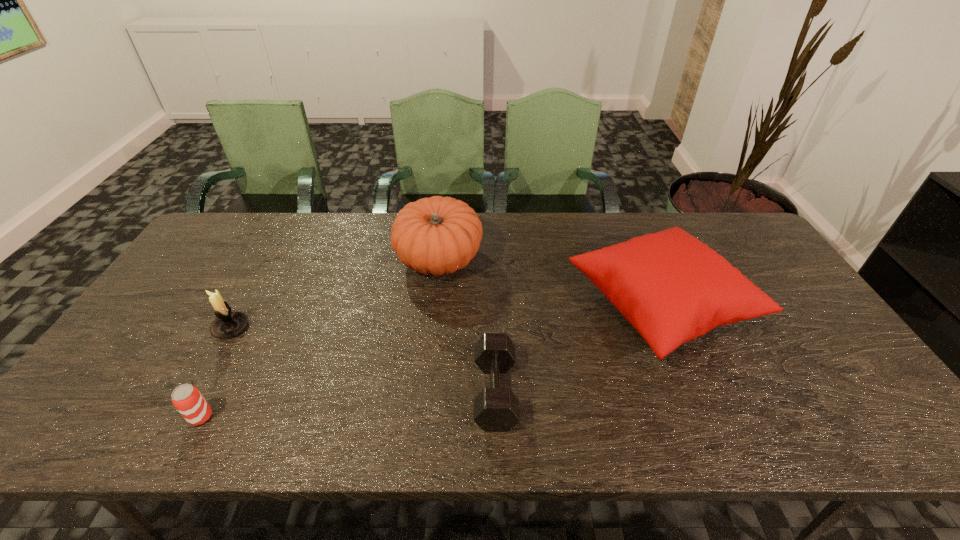
This screenshot has height=540, width=960. I want to click on pumpkin, so click(438, 235).

Locate an element on the screen. The image size is (960, 540). cushion is located at coordinates (671, 287).

At what (x,y) coordinates should I click in order to perform the action: click on candle holder. Please return your answer as a coordinate pair (x, y). The height and width of the screenshot is (540, 960). Looking at the image, I should click on (227, 324).

Identify the location of beer can. tap(187, 399).

Where is `dumbbell`? dumbbell is located at coordinates (496, 409).

Locate an element on the screen. vacant region located 0.320m on the front of the pumpkin is located at coordinates (426, 382).

Image resolution: width=960 pixels, height=540 pixels. Find the location of `free spot located 0.120m on the left of the cushion`. free spot located 0.120m on the left of the cushion is located at coordinates (528, 306).

Locate an element on the screen. Image resolution: width=960 pixels, height=540 pixels. vacant space located 0.230m on the back of the third shortest object is located at coordinates (268, 261).

Image resolution: width=960 pixels, height=540 pixels. What are the coordinates of `vacant space located 0.280m on the back of the beer can` in the screenshot? It's located at (252, 317).

This screenshot has height=540, width=960. In order to click on vacant area located 0.200m on the right of the dumbbell in this screenshot , I will do `click(601, 392)`.